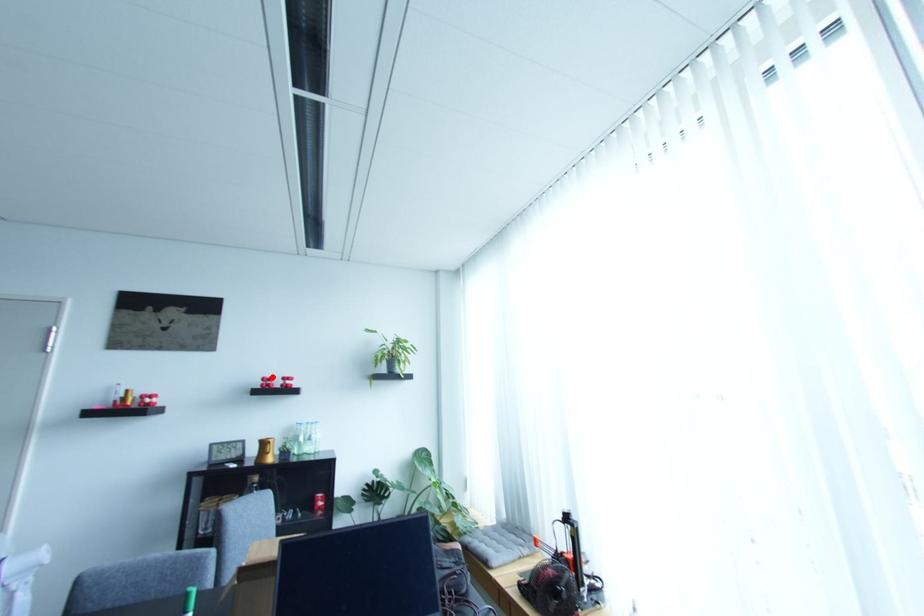
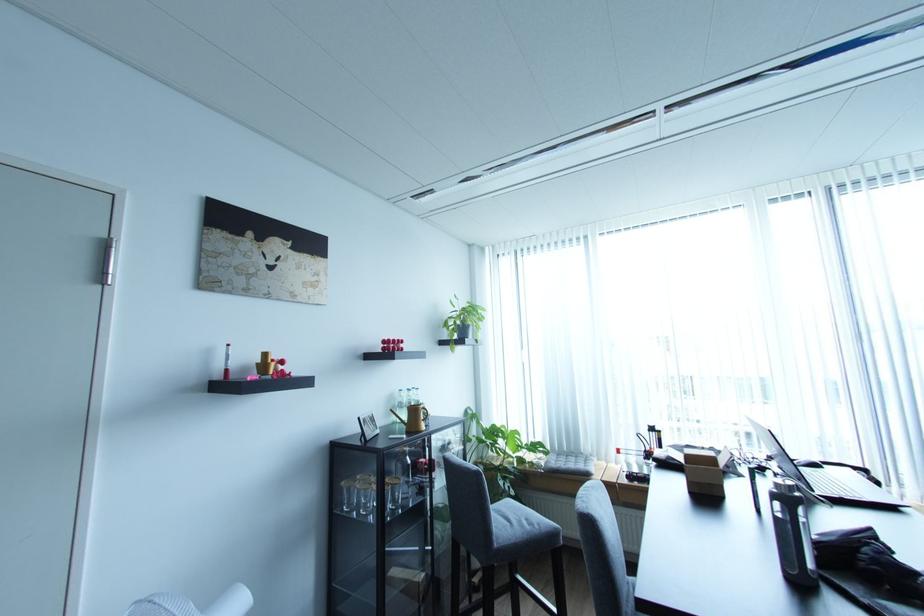
The point at the highlighted location is marked in the first image. Where is the corresponding point in the second image?

(395, 339)